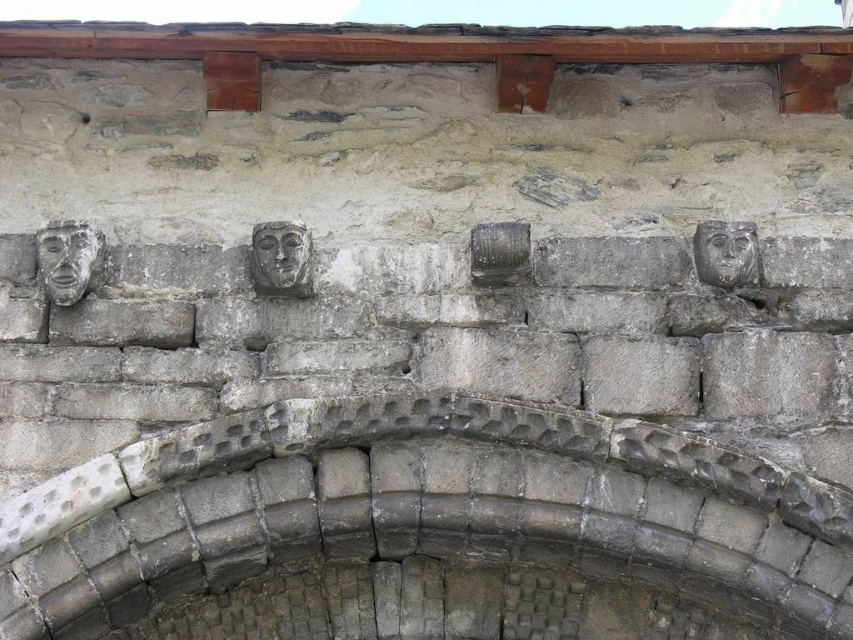
Does gray stone arch at center appear over gray stone face at upper right?

Incorrect, gray stone arch at center is not positioned above gray stone face at upper right.

Which is behind, point (503, 541) or point (746, 266)?

The point (746, 266) is behind.

Find the location of `gray stone arch at center`. gray stone arch at center is located at coordinates (422, 509).

Who is more forward, (50, 285) or (282, 236)?

Positioned in front is point (50, 285).

Who is more distant from viewer, (39, 273) or (264, 284)?

The point (39, 273) is more distant.

The width and height of the screenshot is (853, 640). What are the coordinates of `gray stone face at upper left` in the screenshot? It's located at (67, 259).

Locate an element on the screen. The image size is (853, 640). gray stone face at upper left is located at coordinates (67, 259).

Is gray stone arch at center thinner than gray stone face at center?

Incorrect, gray stone arch at center's width is not less than gray stone face at center's.

Can you confirm if gray stone arch at center is taller than gray stone face at center?

Correct, gray stone arch at center is much taller as gray stone face at center.

Find the location of a particular element. gray stone arch at center is located at coordinates (422, 509).